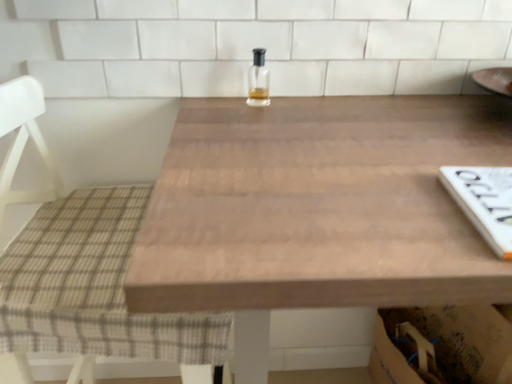
Where is `spots to the right of clear glass bottle at center`? spots to the right of clear glass bottle at center is located at coordinates (336, 111).